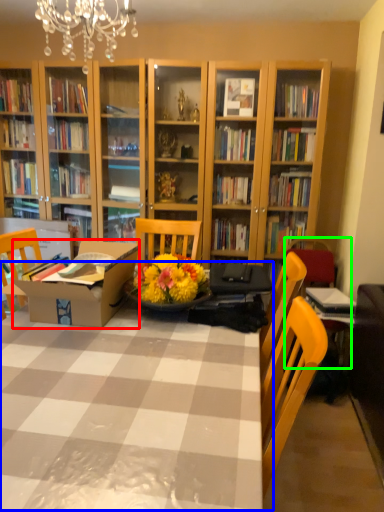
Question: Which object is positioned closest to cardboard box (highlighted by a red box)? Select from table (highlighted by a blue box) and armchair (highlighted by a green box).

Choices:
 (A) table
 (B) armchair

Answer: (A)